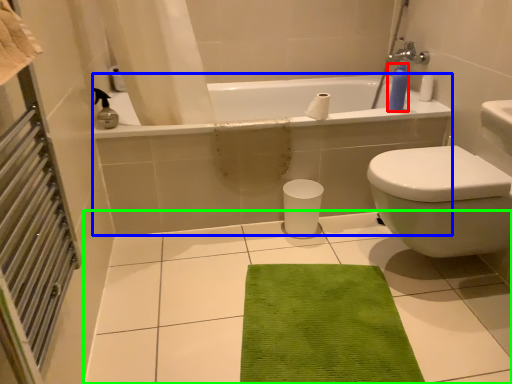
Question: Which is farther away from soap dispenser (highlighted by a red box)? bath (highlighted by a blue box) or ceramic tile (highlighted by a green box)?

Choices:
 (A) bath
 (B) ceramic tile

Answer: (B)